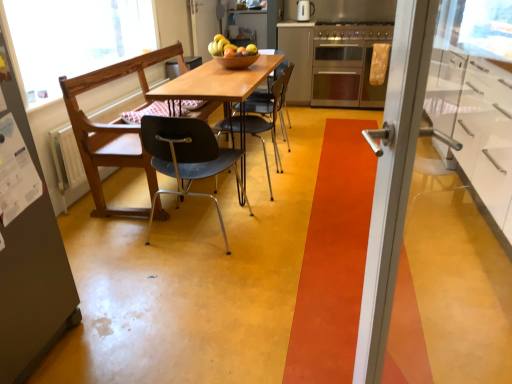
What do you see at coordinates (229, 48) in the screenshot? The width and height of the screenshot is (512, 384). I see `shiny brown bowl at center` at bounding box center [229, 48].

Describe the element at coordinates (347, 64) in the screenshot. I see `stainless steel oven at center` at that location.

What is the approximate width of satin silver cabinet at center, the 2th cabinetry when ordered from front to back?

The width of satin silver cabinet at center, the 2th cabinetry when ordered from front to back, is 26.18 inches.

The width and height of the screenshot is (512, 384). Describe the element at coordinates (297, 59) in the screenshot. I see `satin silver cabinet at center, placed as the 1th cabinetry when sorted from top to bottom` at that location.

Find the location of a particular element. The image size is (512, 384). wooden bowl at center is located at coordinates pyautogui.click(x=237, y=61).

What do you see at coordinates (272, 118) in the screenshot? I see `metallic blue chair at center, the 1th chair positioned from the back` at bounding box center [272, 118].

This screenshot has height=384, width=512. What do you see at coordinates (354, 30) in the screenshot?
I see `stainless steel stove at upper center` at bounding box center [354, 30].

The height and width of the screenshot is (384, 512). What are the coordinates of `wooden chair at center, the 2th chair when ordered from front to back` in the screenshot? It's located at (114, 129).

In order to click on shiny brown bowl at center in this screenshot , I will do `click(229, 48)`.

Is satin silver cabinet at center, the first cabinetry when ordered from left to right, touching metallic blue chair at center, the 1th chair positioned from the back?

There is a gap between satin silver cabinet at center, the first cabinetry when ordered from left to right, and metallic blue chair at center, the 1th chair positioned from the back.

Is satin silver cabinet at center, the first cabinetry when ordered from left to right, positioned with its back to metallic blue chair at center, the 1th chair positioned from the back?

No, satin silver cabinet at center, the first cabinetry when ordered from left to right,'s orientation is not away from metallic blue chair at center, the 1th chair positioned from the back.

From the image's perspective, relative to metallic blue chair at center, the 1th chair positioned from the back, is satin silver cabinet at center, the 2th cabinetry when ordered from front to back, above or below?

Clearly, from the image's perspective, satin silver cabinet at center, the 2th cabinetry when ordered from front to back, is above metallic blue chair at center, the 1th chair positioned from the back.

Considering the positions of objects satin silver cabinet at center, the first cabinetry when ordered from left to right, and metallic blue chair at center, the 1th chair positioned from the back, in the image provided, who is behind, satin silver cabinet at center, the first cabinetry when ordered from left to right, or metallic blue chair at center, the 1th chair positioned from the back,?

satin silver cabinet at center, the first cabinetry when ordered from left to right, is further away from the camera.

Locate an element on the screen. stove lying in front of the satin silver cabinet at center, which appears as the first cabinetry when viewed from the back is located at coordinates (354, 30).

Which object is more forward, stainless steel stove at upper center or satin silver cabinet at center, the first cabinetry when ordered from left to right?

stainless steel stove at upper center.

Does stainless steel stove at upper center touch satin silver cabinet at center, the first cabinetry when ordered from left to right?

No, stainless steel stove at upper center is not touching satin silver cabinet at center, the first cabinetry when ordered from left to right.

Is stainless steel stove at upper center smaller than satin silver cabinet at center, placed as the 1th cabinetry when sorted from top to bottom?

Yes, stainless steel stove at upper center is smaller than satin silver cabinet at center, placed as the 1th cabinetry when sorted from top to bottom.

From the image's perspective, which object appears higher, matte black chair at center, the first chair positioned from the front, or matte silver kettle at upper center?

matte silver kettle at upper center is shown above in the image.

Considering the relative sizes of matte black chair at center, positioned as the third chair in back-to-front order, and matte silver kettle at upper center in the image provided, is matte black chair at center, positioned as the third chair in back-to-front order, smaller than matte silver kettle at upper center?

No.

Is matte black chair at center, positioned as the third chair in back-to-front order, not close to matte silver kettle at upper center?

matte black chair at center, positioned as the third chair in back-to-front order, is far away from matte silver kettle at upper center.

From the picture: From the image's perspective, which object appears higher, matte silver kettle at upper center or matte black chair at center, positioned as the third chair in back-to-front order?

matte silver kettle at upper center appears higher in the image.

Between point (307, 6) and point (166, 148), which one is positioned behind?

The point (307, 6) is farther from the camera.

Is matte silver kettle at upper center not close to matte black chair at center, positioned as the third chair in back-to-front order?

Yes, matte silver kettle at upper center and matte black chair at center, positioned as the third chair in back-to-front order, are located far from each other.

From a real-world perspective, is matte silver kettle at upper center above or below matte black chair at center, the first chair positioned from the front?

matte silver kettle at upper center is above matte black chair at center, the first chair positioned from the front.

Is matte silver kettle at upper center oriented towards satin silver cabinet at center, the first cabinetry when ordered from left to right?

No, matte silver kettle at upper center does not turn towards satin silver cabinet at center, the first cabinetry when ordered from left to right.

Is matte silver kettle at upper center with satin silver cabinet at center, the first cabinetry when ordered from left to right?

No, matte silver kettle at upper center is not making contact with satin silver cabinet at center, the first cabinetry when ordered from left to right.

Based on the photo, considering the relative positions of matte silver kettle at upper center and satin silver cabinet at center, acting as the 2th cabinetry starting from the bottom, in the image provided, is matte silver kettle at upper center to the right of satin silver cabinet at center, acting as the 2th cabinetry starting from the bottom, from the viewer's perspective?

Yes, matte silver kettle at upper center is to the right of satin silver cabinet at center, acting as the 2th cabinetry starting from the bottom.

Which of these two, matte silver kettle at upper center or satin silver cabinet at center, the 2th cabinetry when ordered from front to back, is bigger?

With larger size is satin silver cabinet at center, the 2th cabinetry when ordered from front to back.

Between wooden bowl at center and stainless steel stove at upper center, which one is positioned in front?

wooden bowl at center.

Is wooden bowl at center not within stainless steel stove at upper center?

wooden bowl at center lies outside stainless steel stove at upper center's area.

How different are the orientations of wooden bowl at center and stainless steel stove at upper center in degrees?

The facing directions of wooden bowl at center and stainless steel stove at upper center are 85.6 degrees apart.

Which object is wider, wooden bowl at center or stainless steel stove at upper center?

stainless steel stove at upper center.

From a real-world perspective, is stainless steel stove at upper center under metallic blue chair at center, positioned as the third chair in front-to-back order?

Incorrect, from a real-world perspective, stainless steel stove at upper center is higher than metallic blue chair at center, positioned as the third chair in front-to-back order.

Does stainless steel stove at upper center have a lesser height compared to metallic blue chair at center, the 1th chair positioned from the back?

Correct, stainless steel stove at upper center is not as tall as metallic blue chair at center, the 1th chair positioned from the back.

Considering the relative positions of stainless steel stove at upper center and metallic blue chair at center, the 1th chair positioned from the back, in the image provided, is stainless steel stove at upper center to the left or to the right of metallic blue chair at center, the 1th chair positioned from the back,?

In the image, stainless steel stove at upper center appears on the right side of metallic blue chair at center, the 1th chair positioned from the back.

Is stainless steel stove at upper center further to the viewer compared to metallic blue chair at center, the 1th chair positioned from the back?

Yes, stainless steel stove at upper center is further from the camera.

Locate an element on the screen. The height and width of the screenshot is (384, 512). the 1st chair counting from the left of the satin silver cabinet at center, the 2th cabinetry when ordered from front to back is located at coordinates (272, 118).

Find the location of a particular element. stove above the satin silver cabinet at center, the 2th cabinetry when ordered from front to back (from the image's perspective) is located at coordinates (354, 30).

Looking at the image, which one is located further to matte silver kettle at upper center, matte black chair at center, the first chair positioned from the front, or stainless steel stove at upper center?

Based on the image, matte black chair at center, the first chair positioned from the front, appears to be further to matte silver kettle at upper center.

When comparing their distances from satin silver cabinet at center, the first cabinetry when ordered from left to right, does stainless steel stove at upper center or wooden bowl at center seem closer?

stainless steel stove at upper center lies closer to satin silver cabinet at center, the first cabinetry when ordered from left to right, than the other object.

Looking at the image, which one is located closer to metallic blue chair at center, the 1th chair positioned from the back, white glossy cabinet at right, marked as the 2th cabinetry in a top-to-bottom arrangement, or orange carpet at center?

orange carpet at center is positioned closer to the anchor metallic blue chair at center, the 1th chair positioned from the back.

Estimate the real-world distances between objects in this image. Which object is further from stainless steel oven at center, wooden chair at center, the 2th chair when ordered from front to back, or orange carpet at center?

Among the two, wooden chair at center, the 2th chair when ordered from front to back, is located further to stainless steel oven at center.

From the image, which object appears to be nearer to shiny brown bowl at center, wooden chair at center, the second chair in the back-to-front sequence, or satin silver cabinet at center, acting as the 2th cabinetry starting from the bottom?

Based on the image, wooden chair at center, the second chair in the back-to-front sequence, appears to be nearer to shiny brown bowl at center.

When comparing their distances from shiny brown bowl at center, does wooden bowl at center or stainless steel stove at upper center seem further?

Among the two, stainless steel stove at upper center is located further to shiny brown bowl at center.

Looking at the image, which one is located further to white glossy cabinet at right, placed as the first cabinetry when sorted from right to left, wooden table at center or wooden chair at center, the second chair in the back-to-front sequence?

wooden chair at center, the second chair in the back-to-front sequence.

Looking at the image, which one is located closer to satin silver cabinet at center, placed as the 1th cabinetry when sorted from top to bottom, orange carpet at center or wooden table at center?

orange carpet at center is positioned closer to the anchor satin silver cabinet at center, placed as the 1th cabinetry when sorted from top to bottom.

What are the coordinates of `stove between matte black chair at center, the first chair positioned from the front, and matte silver kettle at upper center from front to back` in the screenshot? It's located at (354, 30).

Identify the location of bowl located between wooden chair at center, the second chair in the back-to-front sequence, and shiny brown bowl at center in the depth direction. (237, 61).

This screenshot has width=512, height=384. I want to click on strip between white glossy cabinet at right, positioned as the second cabinetry in back-to-front order, and wooden bowl at center, along the z-axis, so pos(333,259).

Identify the location of strip located between white glossy cabinet at right, which is the first cabinetry from front to back, and shiny brown bowl at center in the depth direction. The width and height of the screenshot is (512, 384). (333, 259).